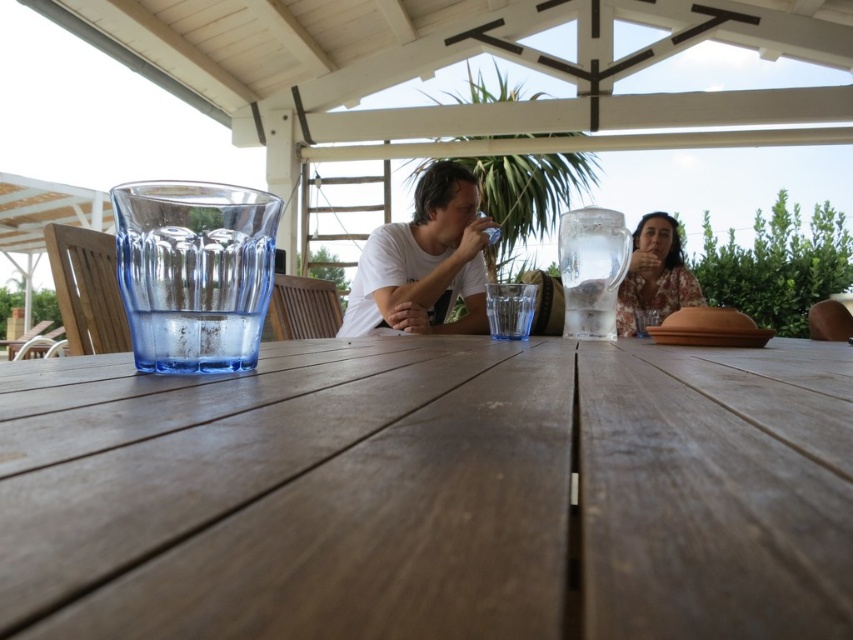
Question: Does clear glass pitcher at upper right appear on the left side of floral fabric blouse at upper right?

Choices:
 (A) yes
 (B) no

Answer: (A)

Question: Which is farther from the white matte t-shirt at center?

Choices:
 (A) clear glass pitcher at upper right
 (B) floral fabric blouse at upper right

Answer: (B)

Question: Among these points, which one is nearest to the camera?

Choices:
 (A) (668, 221)
 (B) (434, 189)
 (C) (608, 262)
 (D) (229, 257)

Answer: (D)

Question: Which of these objects is positioned closest to the brown wooden table at center?

Choices:
 (A) floral fabric blouse at upper right
 (B) clear glass pitcher at upper right
 (C) transparent glass at left
 (D) white matte t-shirt at center

Answer: (C)

Question: Is white matte t-shirt at center wider than floral fabric blouse at upper right?

Choices:
 (A) yes
 (B) no

Answer: (B)

Question: Is brown wooden table at center below clear glass pitcher at upper right?

Choices:
 (A) no
 (B) yes

Answer: (B)